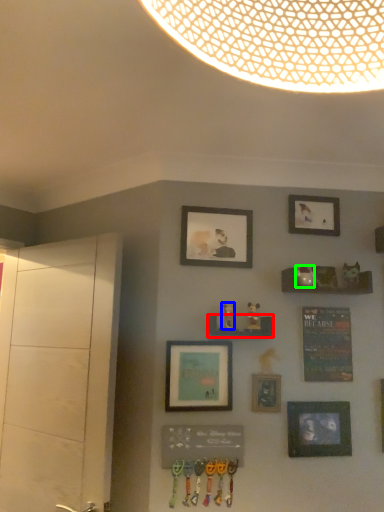
Question: Which object is the closest to the shelf (highlighted by a red box)? Choose among these: art (highlighted by a blue box) or art (highlighted by a green box).

Choices:
 (A) art
 (B) art

Answer: (A)